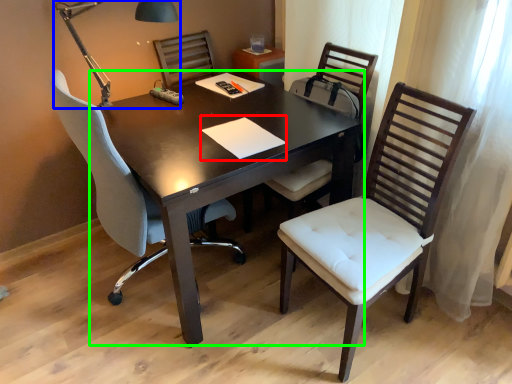
Question: Which is farther away from notepad (highlighted by a red box)? table lamp (highlighted by a blue box) or table (highlighted by a green box)?

Choices:
 (A) table lamp
 (B) table

Answer: (A)